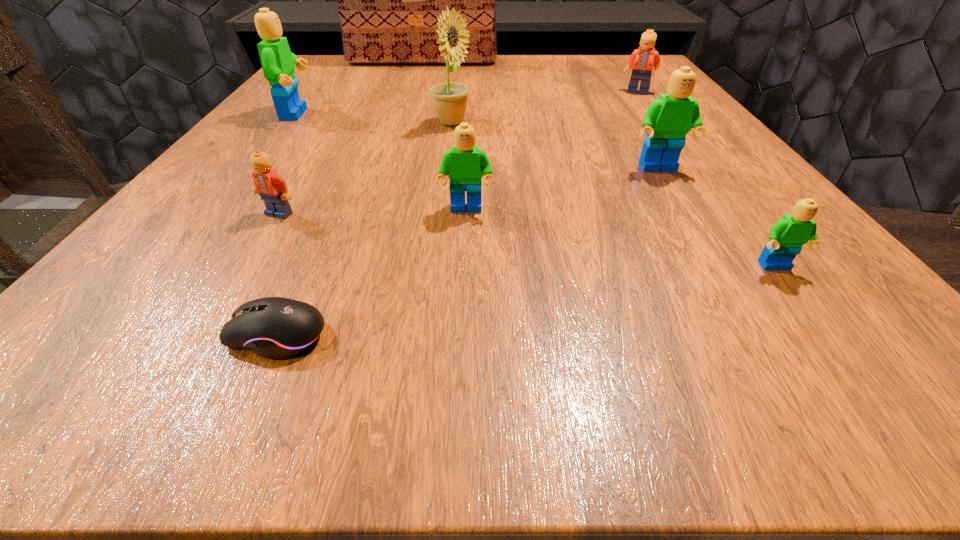
I want to click on brown handbag, so click(388, 0).

Identify the location of handbag. The width and height of the screenshot is (960, 540). (388, 0).

Image resolution: width=960 pixels, height=540 pixels. In order to click on sunflower in this screenshot , I will do `click(450, 99)`.

Find the location of a particular element. The image size is (960, 540). the leftmost Lego is located at coordinates (278, 62).

Find the location of a particular element. The width and height of the screenshot is (960, 540). the leftmost green Lego is located at coordinates (278, 62).

Where is `the fifth farthest object`? Image resolution: width=960 pixels, height=540 pixels. the fifth farthest object is located at coordinates [669, 118].

Identify the location of the second tallest Lego. (669, 118).

The height and width of the screenshot is (540, 960). Find the location of `the farther orange Lego`. the farther orange Lego is located at coordinates (646, 58).

Find the location of a particular element. The width and height of the screenshot is (960, 540). the eighth nearest object is located at coordinates (646, 58).

Image resolution: width=960 pixels, height=540 pixels. I want to click on the third green Lego from right to left, so click(x=466, y=165).